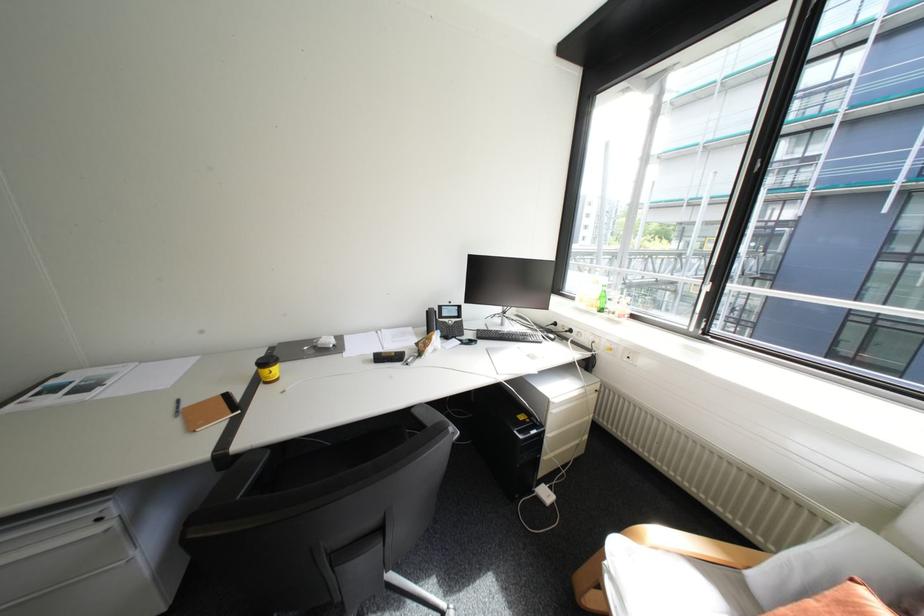
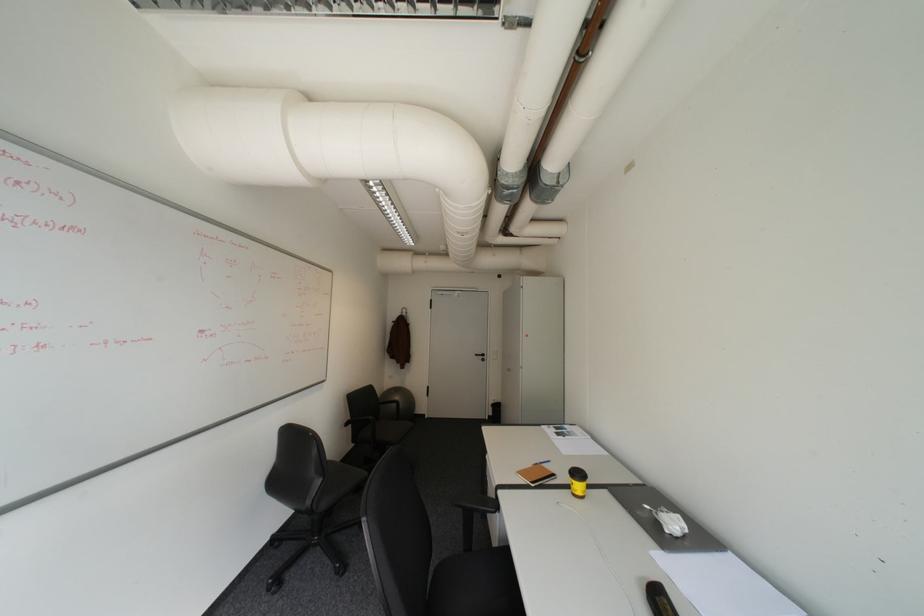
Find the pixel in the second image that matches pixel 186 416 in the first image.

(543, 464)